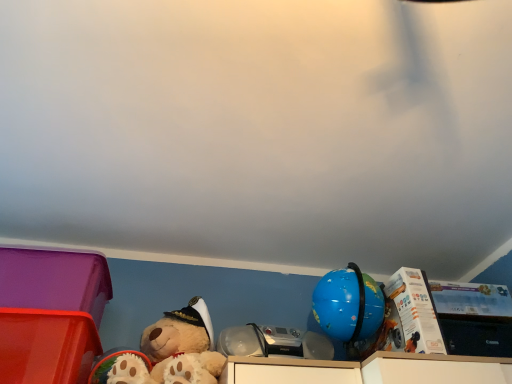
Question: From the image's perspective, is matte plastic storage box at lower left, placed as the 3th storage box when sorted from right to left, over white cardboard box at upper right, acting as the 1th storage box starting from the right?

Choices:
 (A) yes
 (B) no

Answer: (A)

Question: Can you confirm if matte plastic storage box at lower left, placed as the 3th storage box when sorted from right to left, is shorter than white cardboard box at upper right, acting as the 1th storage box starting from the right?

Choices:
 (A) yes
 (B) no

Answer: (B)

Question: Could you tell me if matte plastic storage box at lower left, the 1th storage box viewed from the left, is facing white cardboard box at upper right, acting as the 1th storage box starting from the right?

Choices:
 (A) yes
 (B) no

Answer: (B)

Question: Is matte plastic storage box at lower left, placed as the 3th storage box when sorted from right to left, not close to white cardboard box at upper right, the 3th storage box viewed from the left?

Choices:
 (A) no
 (B) yes

Answer: (B)

Question: From a real-world perspective, is matte plastic storage box at lower left, placed as the 3th storage box when sorted from right to left, under white cardboard box at upper right, acting as the 1th storage box starting from the right?

Choices:
 (A) no
 (B) yes

Answer: (B)

Question: Is matte plastic storage box at lower left, placed as the 3th storage box when sorted from right to left, wider than white cardboard box at upper right, the 3th storage box viewed from the left?

Choices:
 (A) no
 (B) yes

Answer: (B)

Question: Considering the relative sizes of matte plastic storage box at lower left, which is counted as the 2th storage box, starting from the right, and matte plastic storage box at lower left, the 1th storage box viewed from the left, in the image provided, is matte plastic storage box at lower left, which is counted as the 2th storage box, starting from the right, shorter than matte plastic storage box at lower left, the 1th storage box viewed from the left,?

Choices:
 (A) yes
 (B) no

Answer: (B)

Question: Is matte plastic storage box at lower left, which is the second storage box from left to right, closer to camera compared to matte plastic storage box at lower left, placed as the 3th storage box when sorted from right to left?

Choices:
 (A) yes
 (B) no

Answer: (A)

Question: Is matte plastic storage box at lower left, which is the second storage box from left to right, next to matte plastic storage box at lower left, the 1th storage box viewed from the left, and touching it?

Choices:
 (A) yes
 (B) no

Answer: (B)

Question: Does matte plastic storage box at lower left, which is counted as the 2th storage box, starting from the right, have a larger size compared to matte plastic storage box at lower left, the 1th storage box viewed from the left?

Choices:
 (A) yes
 (B) no

Answer: (B)

Question: Is matte plastic storage box at lower left, which is the second storage box from left to right, behind matte plastic storage box at lower left, placed as the 3th storage box when sorted from right to left?

Choices:
 (A) yes
 (B) no

Answer: (B)

Question: Is matte plastic storage box at lower left, which is the second storage box from left to right, far from matte plastic storage box at lower left, the 1th storage box viewed from the left?

Choices:
 (A) yes
 (B) no

Answer: (B)

Question: Is white cardboard box at upper right, the 3th storage box viewed from the left, positioned with its back to fluffy beige teddy bear at lower left?

Choices:
 (A) yes
 (B) no

Answer: (B)